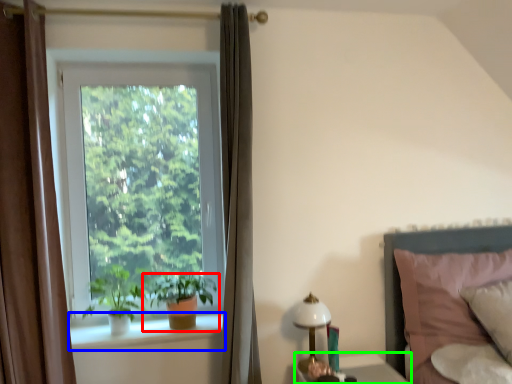
Question: Which is farther away from houseplant (highlighted by a red box)? window sill (highlighted by a blue box) or table (highlighted by a green box)?

Choices:
 (A) window sill
 (B) table

Answer: (B)